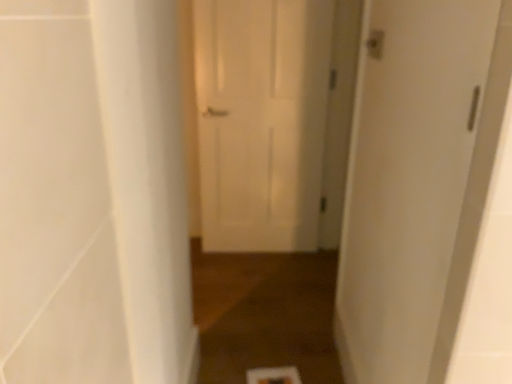
Question: In the image, is white matte door at right, marked as the 2th door in a back-to-front arrangement, positioned in front of or behind brown wood floor at center?

Choices:
 (A) front
 (B) behind

Answer: (A)

Question: Considering the positions of white matte door at right, arranged as the second door when viewed from the left, and brown wood floor at center in the image, is white matte door at right, arranged as the second door when viewed from the left, taller or shorter than brown wood floor at center?

Choices:
 (A) tall
 (B) short

Answer: (A)

Question: Which of these objects is positioned closest to the brown wood floor at center?

Choices:
 (A) white matte door at right, arranged as the second door when viewed from the left
 (B) white smooth pillar at left
 (C) white matte door at center, placed as the 1th door when sorted from back to front

Answer: (B)

Question: Which object is positioned closest to the brown wood floor at center?

Choices:
 (A) white matte door at center, the first door in the left-to-right sequence
 (B) white matte door at right, arranged as the first door when viewed from the right
 (C) white smooth pillar at left

Answer: (C)